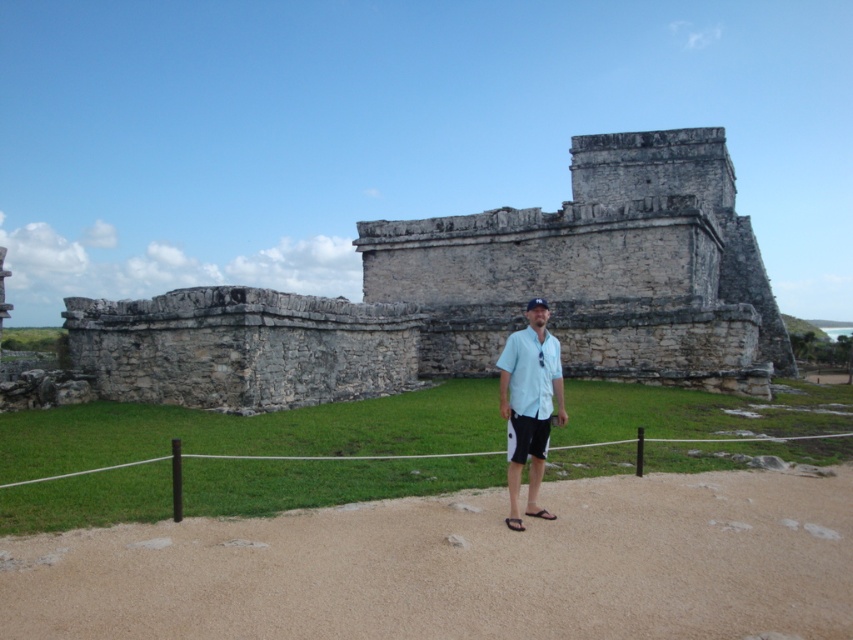
Who is lower down, gray stone castle at center or light blue fabric shirt at center?

light blue fabric shirt at center

Does gray stone castle at center have a smaller size compared to light blue fabric shirt at center?

No.

Locate an element on the screen. The height and width of the screenshot is (640, 853). gray stone castle at center is located at coordinates (480, 296).

From the picture: Is gray stone castle at center bigger than light blue cotton polo shirt at center?

Correct, gray stone castle at center is larger in size than light blue cotton polo shirt at center.

Which is behind, point (431, 298) or point (532, 381)?

The point (431, 298) is more distant.

I want to click on gray stone castle at center, so click(480, 296).

Locate an element on the screen. light blue fabric shirt at center is located at coordinates (529, 404).

Is light blue fabric shirt at center thinner than light blue cotton polo shirt at center?

In fact, light blue fabric shirt at center might be wider than light blue cotton polo shirt at center.

Find the location of a particular element. Image resolution: width=853 pixels, height=640 pixels. light blue fabric shirt at center is located at coordinates (529, 404).

Find the location of a particular element. The image size is (853, 640). light blue fabric shirt at center is located at coordinates (529, 404).